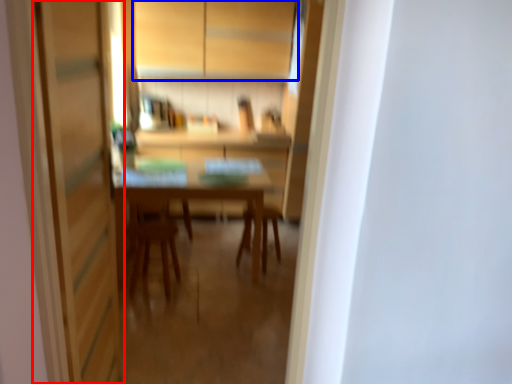
Question: Among these objects, which one is nearest to the camera, screen door (highlighted by a red box) or cabinetry (highlighted by a blue box)?

Choices:
 (A) screen door
 (B) cabinetry

Answer: (A)